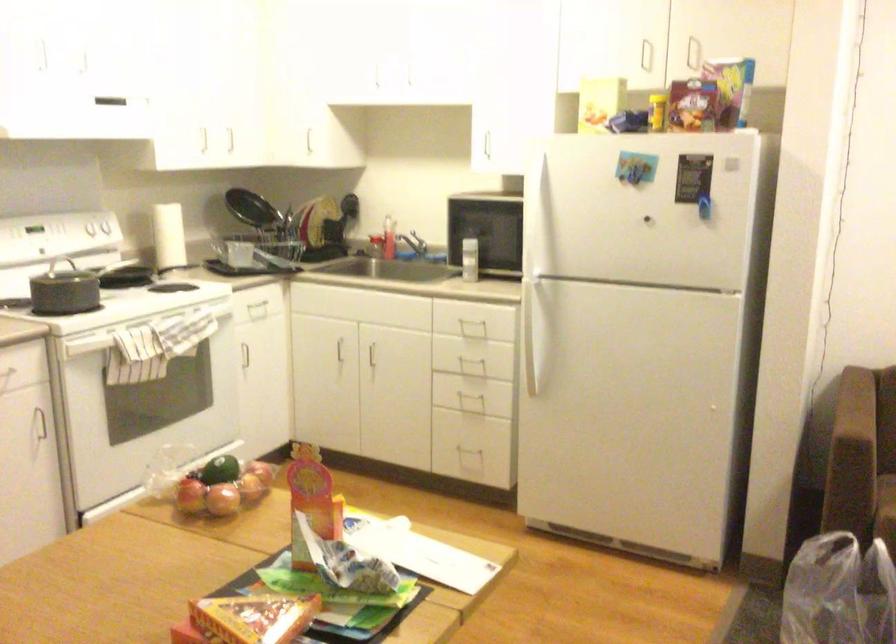
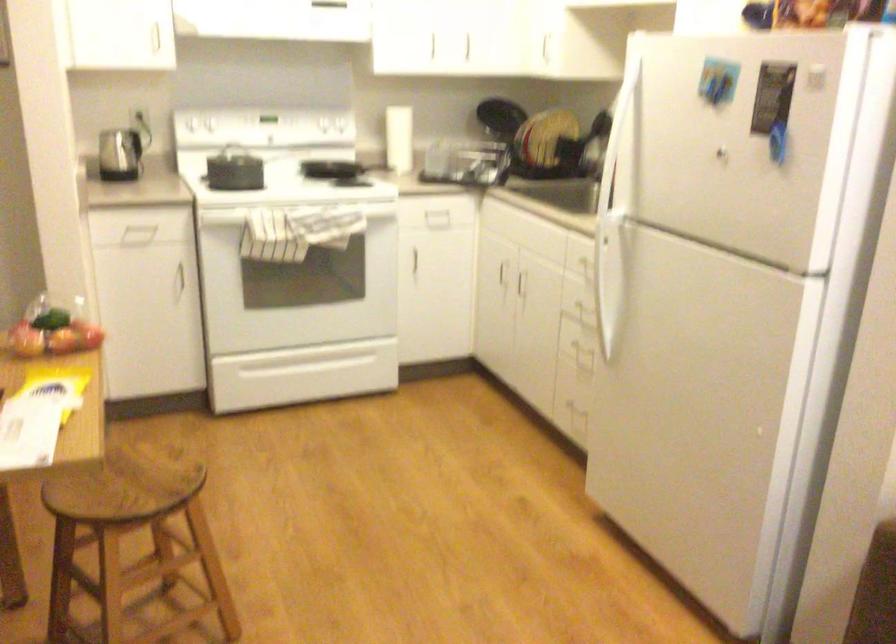
In the second image, find the point that corresponds to point (531, 332) in the first image.

(607, 283)